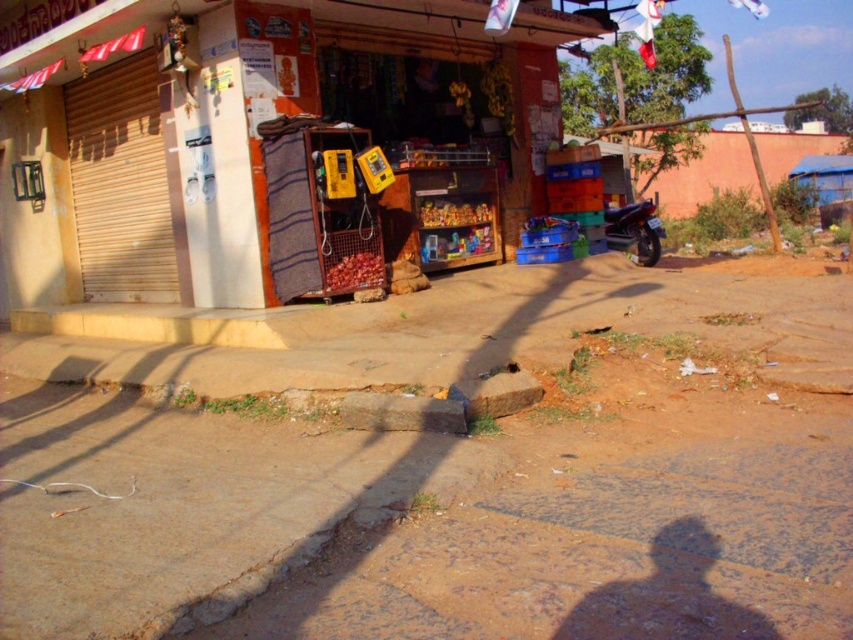
You need to park your car next to the metallic blue motorcycle at right. Where should you position your car relative to the motorcycle?

The metallic blue motorcycle at right is located at point (634, 228), so you should park your car next to it at that coordinate.

You are a delivery person who needs to park your metallic blue motorcycle at right and place your yellow plastic phone box at center in front of the shop. Given the dirt ground with patches of grass and scattered debris in front of the shop, which object would you need to move first to create space?

The metallic blue motorcycle at right is to the right of the yellow plastic phone box at center. To create space, you should move the yellow plastic phone box at center first because it is closer to the center where more debris might be, or maybe the motorcycle is blocking access. Wait, but according to the description, the motorcycle is to the right of the phone box. Hmm, maybe the question is about spatial arrangement. Since the motorcycle is to the right of the phone box, if you want to park and place,

You need to park your car which is 4 meters long in front of the shop. The metallic blue motorcycle at right and the yellow plastic phone box at center are in the way. Which object should you move first to create enough space for your car?

The metallic blue motorcycle at right has a larger size compared to yellow plastic phone box at center. Therefore, you should move the metallic blue motorcycle at right first because it takes up more space, allowing you to free up enough room for your 4 meters long car.